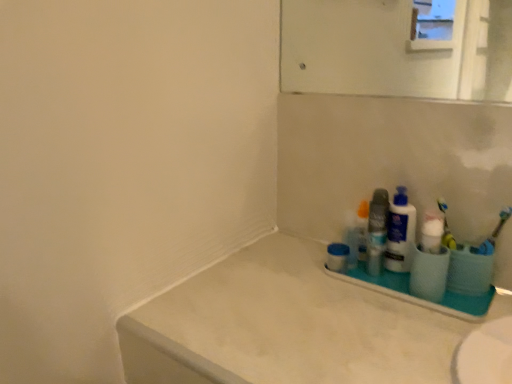
At what (x,y) coordinates should I click in order to perform the action: click on empty space that is ontop of white matte counter top at lower right (from a real-world perspective). Please return your answer as a coordinate pair (x, y). The width and height of the screenshot is (512, 384). Looking at the image, I should click on (335, 306).